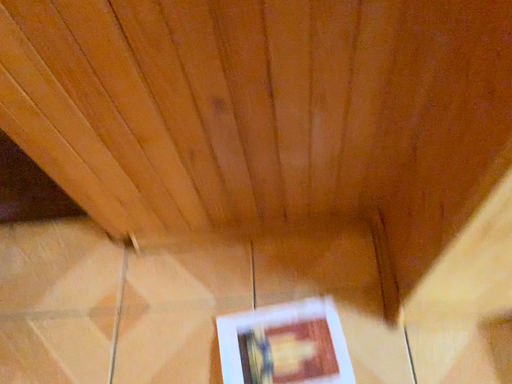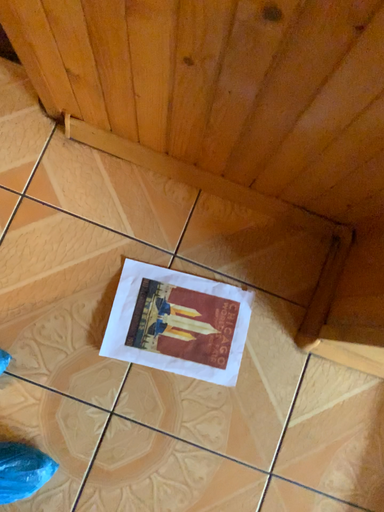
Question: Which way did the camera rotate in the video?

Choices:
 (A) rotated upward
 (B) rotated downward

Answer: (B)